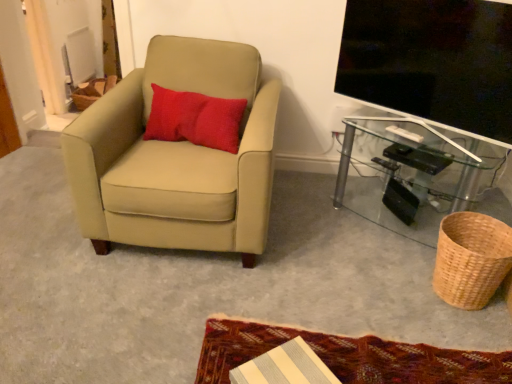
The height and width of the screenshot is (384, 512). I want to click on free space that is to the left of transparent glass table at lower right, so click(311, 216).